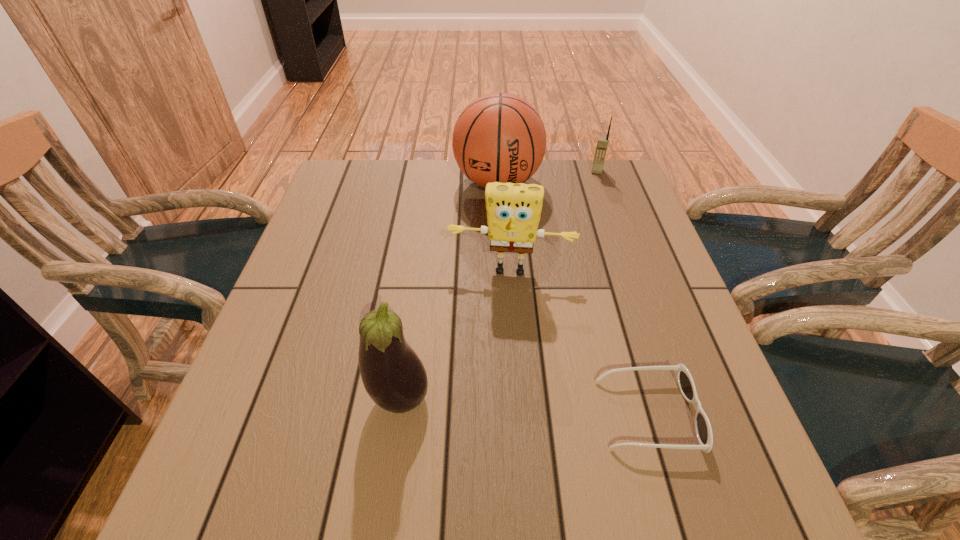
In order to click on vacant space on the desktop that is between the leftmost object and the shortest object and is positioned on the face of the sponge in this screenshot , I will do `click(501, 404)`.

Image resolution: width=960 pixels, height=540 pixels. I want to click on vacant spot on the desktop that is between the leftmost object and the sunglasses and is positioned on the front of the second shortest object, where the keypad is located, so click(x=549, y=407).

Locate an element on the screen. The height and width of the screenshot is (540, 960). free space on the desktop that is between the leftmost object and the shortest object and is positioned on the surface of the basketball near the brand logo is located at coordinates (488, 403).